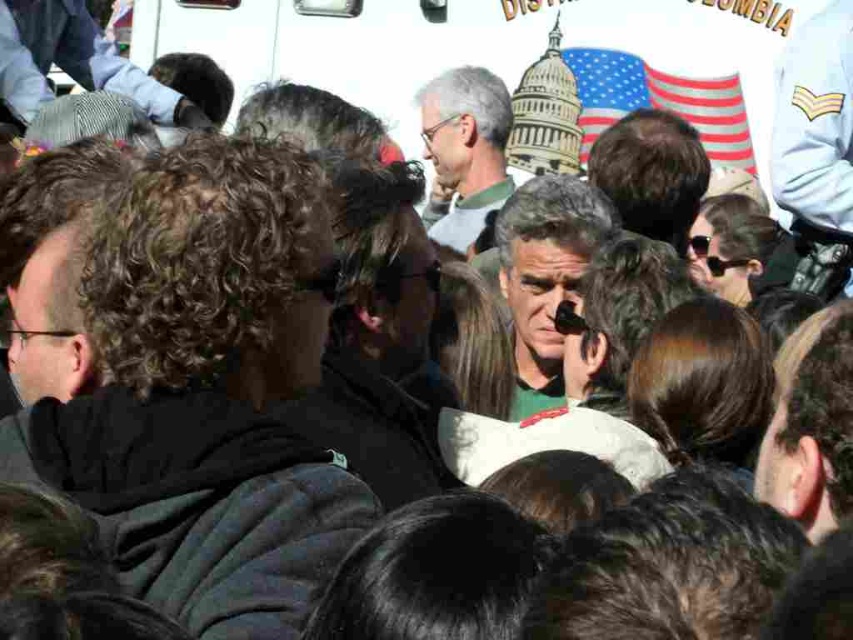
You are a photographer trying to capture a photo of the gray hair man at center and dark curly hair at center. Which of the two should you adjust your camera angle to the left to include in the frame first?

The dark curly hair at center is positioned on the left side of gray hair man at center, so adjusting the camera angle to the left would first include the dark curly hair at center in the frame.

You are a photographer trying to capture a photo of the Capitol building in the background. You notice two points in your viewfinder labeled as point 1 at coordinates point 1 at coordinates point [538,285] and point 2 at coordinates point [434,100]. Which point should you focus on to ensure the Capitol building is in sharp focus?

You should focus on point [538,285] because it is closer to the camera than point [434,100], making it easier to capture the Capitol building in sharp focus.

You are a photographer trying to capture a photo of the Capitol building in the background. You notice two people in the crowd at the center of the image, a dark curly hair at center and a gray hair man at center. Which person might be blocking your view of the Capitol building more due to their height?

The dark curly hair at center is taller than gray hair man at center, so they would block more of the view of the Capitol building.